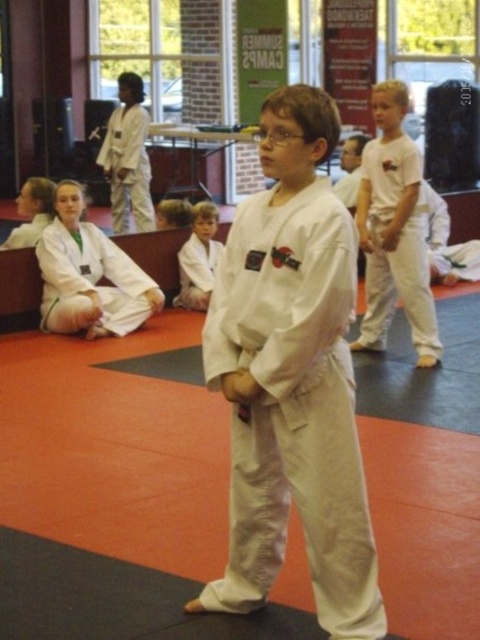
Question: Among these objects, which one is nearest to the camera?

Choices:
 (A) white cotton karate uniform at center
 (B) white cotton karate gi at center

Answer: (A)

Question: Does white cotton karate uniform at center appear on the right side of white cotton karate gi at center?

Choices:
 (A) no
 (B) yes

Answer: (B)

Question: Is white cotton karate uniform at center to the right of white cotton karate gi at center from the viewer's perspective?

Choices:
 (A) no
 (B) yes

Answer: (B)

Question: Which of the following is the farthest from the observer?

Choices:
 (A) (381, 125)
 (B) (216, 211)

Answer: (B)

Question: Can you confirm if white cotton karate uniform at center is positioned to the right of white cotton karate gi at center?

Choices:
 (A) yes
 (B) no

Answer: (A)